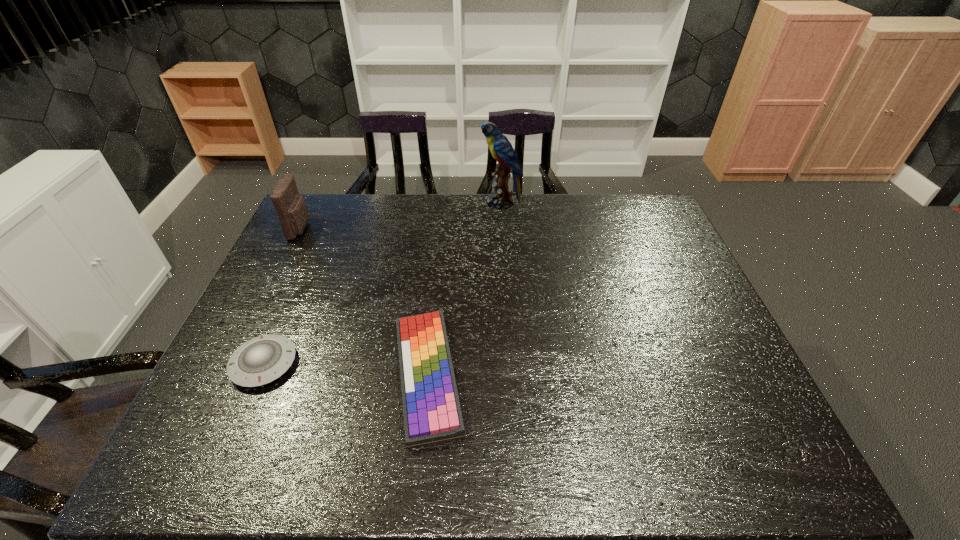
At what (x,y) coordinates should I click in order to perform the action: click on parrot. Please return your answer as a coordinate pair (x, y). Looking at the image, I should click on (501, 149).

The image size is (960, 540). In order to click on the tallest object in this screenshot , I will do pyautogui.click(x=501, y=149).

In order to click on pouch in this screenshot , I will do `click(290, 207)`.

Where is `the third shortest object`? The image size is (960, 540). the third shortest object is located at coordinates (290, 207).

Where is `saucer`? saucer is located at coordinates (261, 360).

The image size is (960, 540). Find the location of `the second object from right to left`. the second object from right to left is located at coordinates (432, 414).

Identify the location of free space located 0.120m on the face of the parrot. (448, 202).

Image resolution: width=960 pixels, height=540 pixels. What are the coordinates of `vacant region located 0.310m on the face of the parrot` in the screenshot? It's located at (396, 202).

Find the location of a particular element. vacant space located 0.050m on the face of the parrot is located at coordinates [468, 202].

Find the location of a particular element. free space located 0.120m with an open flap on the third shortest object is located at coordinates (345, 228).